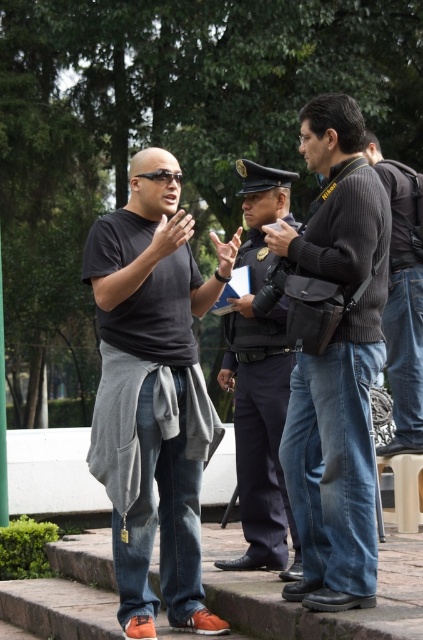
Does dark gray sweater at center have a greater width compared to matte black shirt at center?

No.

Can you confirm if dark gray sweater at center is positioned below matte black shirt at center?

No, dark gray sweater at center is not below matte black shirt at center.

Locate an element on the screen. dark gray sweater at center is located at coordinates (335, 358).

Does point (206, 305) come in front of point (253, 452)?

That is True.

Is matte black shirt at center in front of dark blue uniform at center?

Yes, it is.

Does point (164, 349) come behind point (260, 179)?

No, (164, 349) is closer to viewer.

Where is `matte black shirt at center`? matte black shirt at center is located at coordinates (158, 385).

Which is below, dark gray sweater at center or dark blue uniform at center?

Answer: dark blue uniform at center is below.

Is dark gray sweater at center bigger than dark blue uniform at center?

No.

Is point (331, 544) farther from camera compared to point (269, 196)?

That is False.

I want to click on dark gray sweater at center, so click(x=335, y=358).